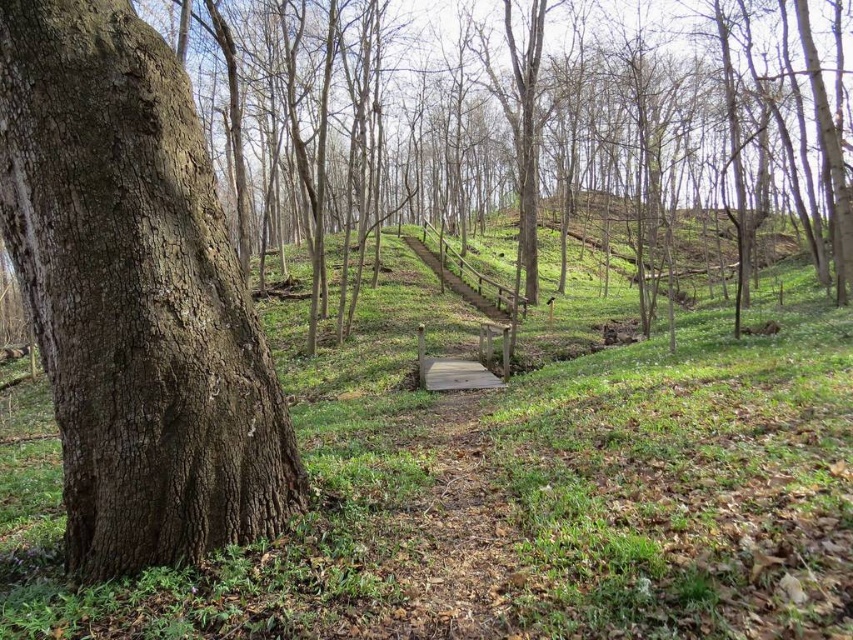
You are a hiker who wants to cross the wooden bridge in the forest scene. You need to step over the green grassy at center and the rough bark tree at left. Which one will you need to step over first?

The rough bark tree at left is taller than the green grassy at center, so you will need to step over the rough bark tree at left first.